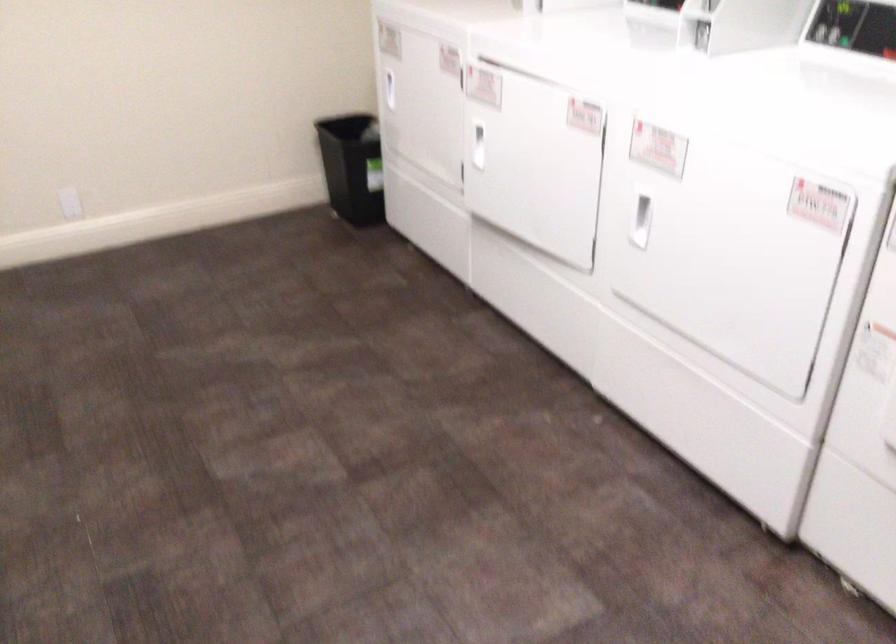
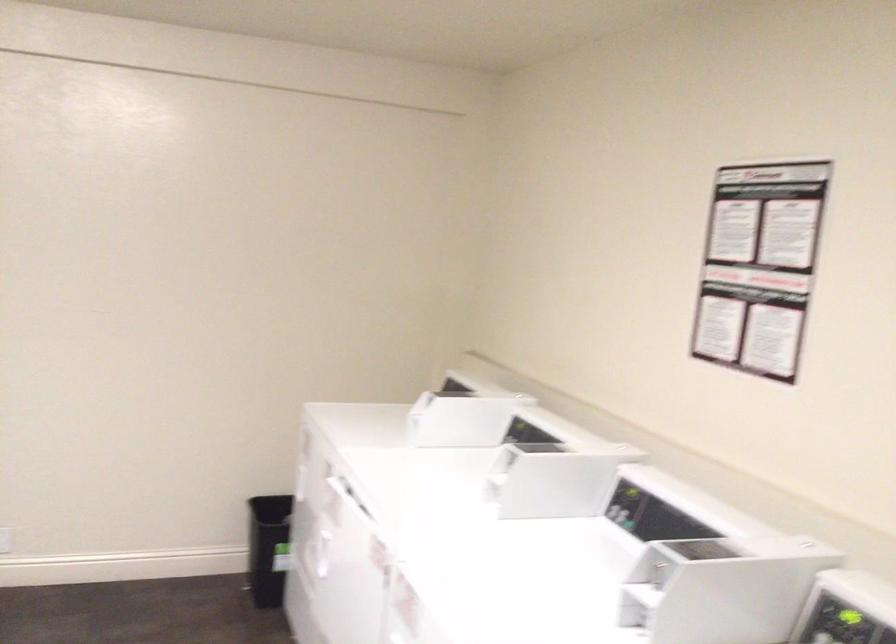
Where in the second image is the point corresponding to point (511, 76) from the first image?

(348, 494)